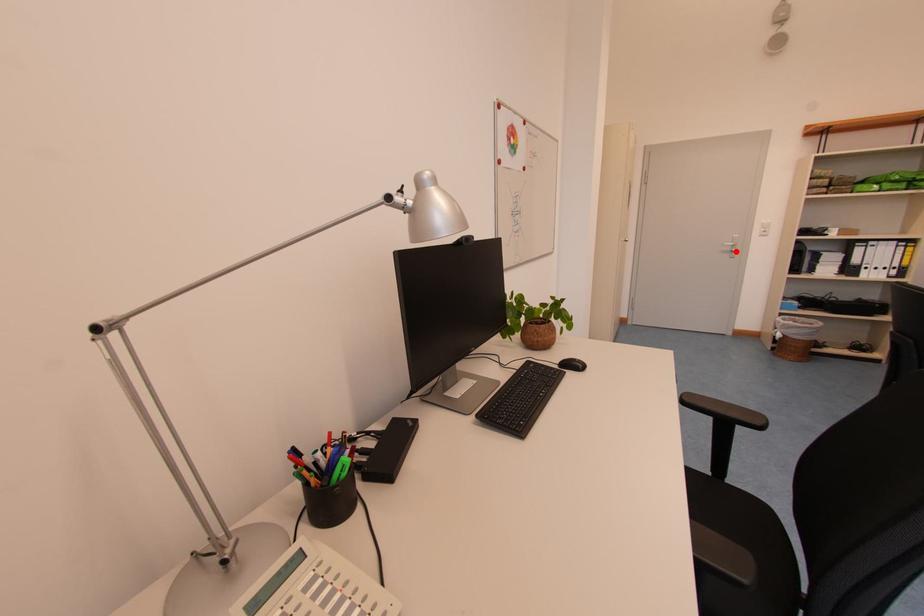
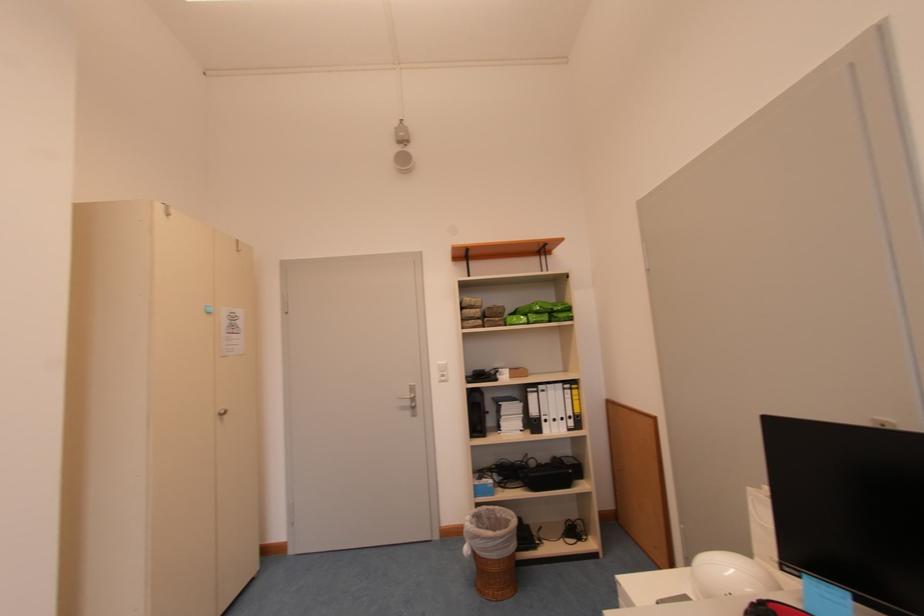
Question: I am providing you with two images of the same scene from different viewpoints. Given a red point in image1, look at the same physical point in image2. Is it:

Choices:
 (A) Closer to the viewpoint
 (B) Farther from the viewpoint

Answer: (B)